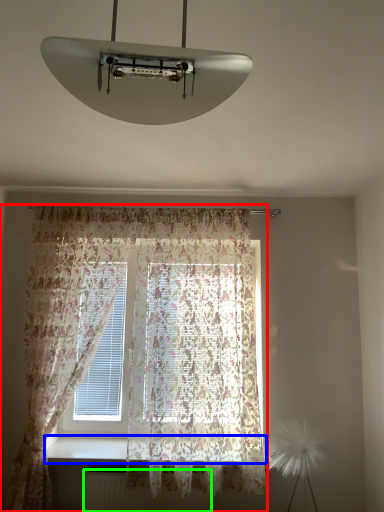
Question: Which object is the farthest from curtain (highlighted by a red box)? Choose among these: window sill (highlighted by a blue box) or radiator (highlighted by a green box).

Choices:
 (A) window sill
 (B) radiator

Answer: (B)